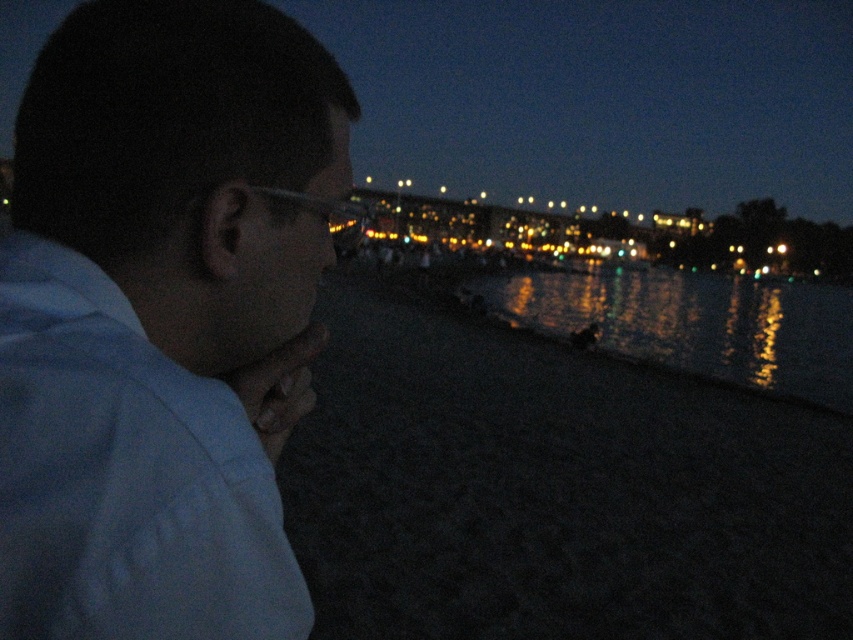
Between point (115, 547) and point (790, 291), which one is positioned behind?

Point (790, 291)

Who is positioned more to the left, white matte shirt at left or glistening reflective water at lower center?

white matte shirt at left

Who is more distant from viewer, (51, 125) or (468, 284)?

The point (468, 284) is behind.

The height and width of the screenshot is (640, 853). I want to click on white matte shirt at left, so click(161, 317).